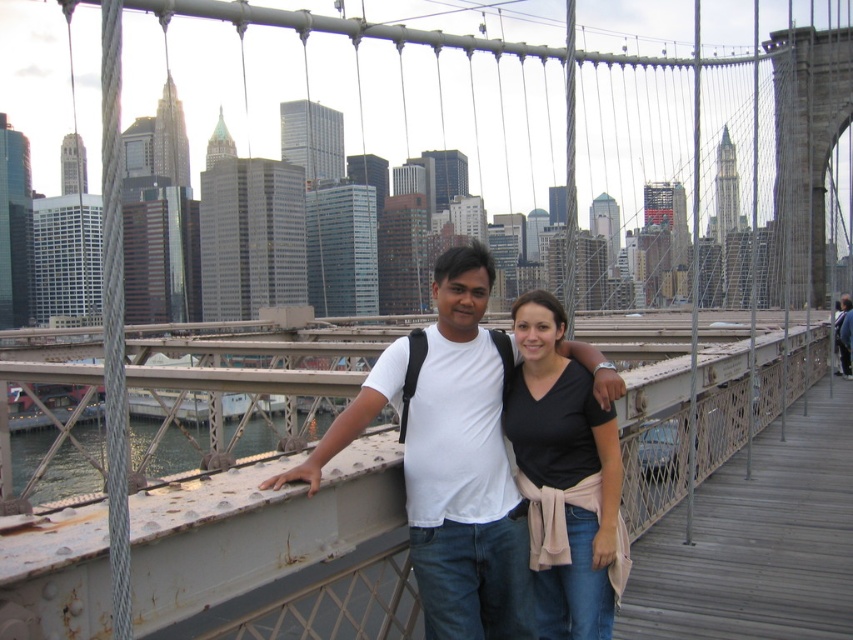
Does white matte t-shirt at center appear over black cotton shirt at center?

Yes, white matte t-shirt at center is above black cotton shirt at center.

Between white matte t-shirt at center and black cotton shirt at center, which one appears on the right side from the viewer's perspective?

black cotton shirt at center

Measure the distance between white matte t-shirt at center and camera.

white matte t-shirt at center is 33.68 meters from camera.

Image resolution: width=853 pixels, height=640 pixels. I want to click on white matte t-shirt at center, so click(450, 458).